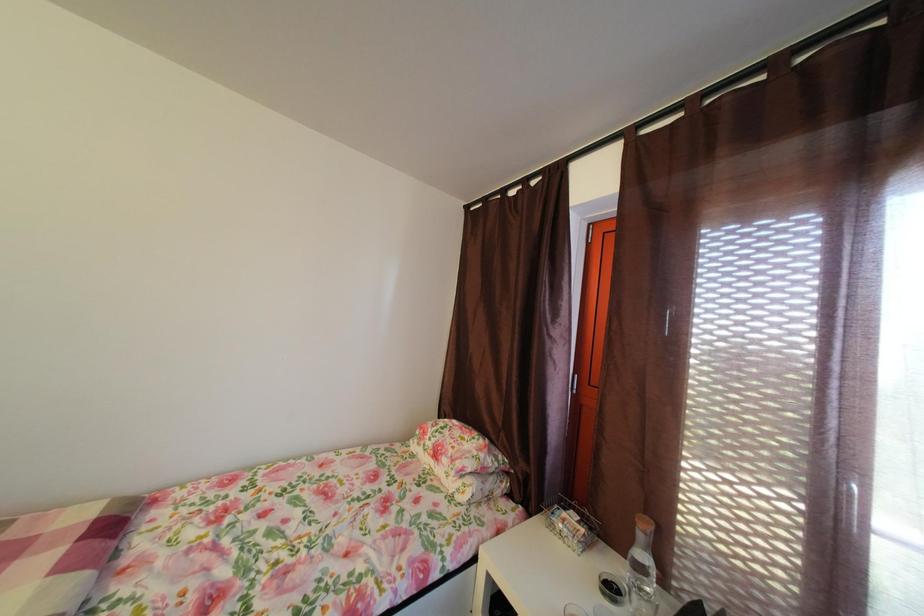
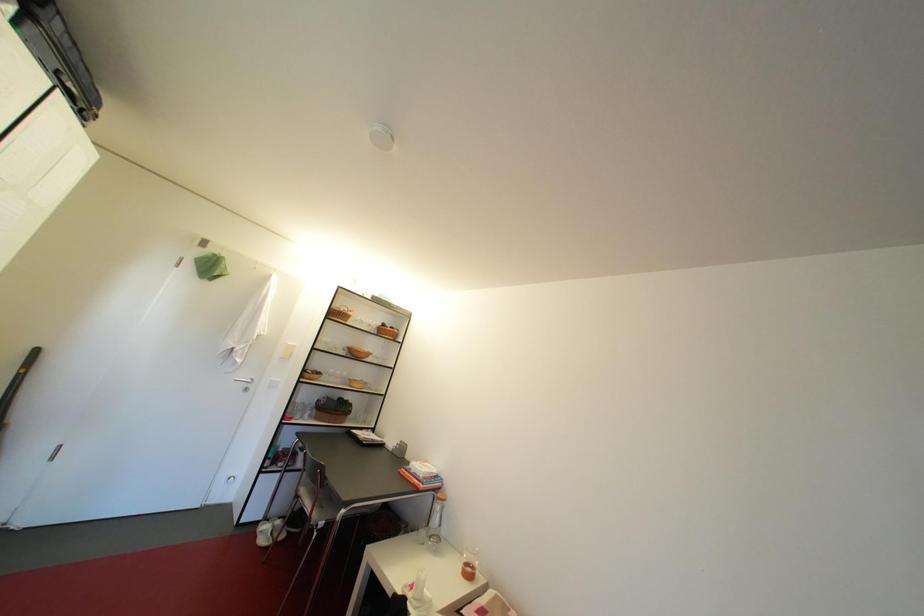
Consider the image. The images are taken continuously from a first-person perspective. In which direction is your viewpoint rotating?

The camera rotated toward left-up.